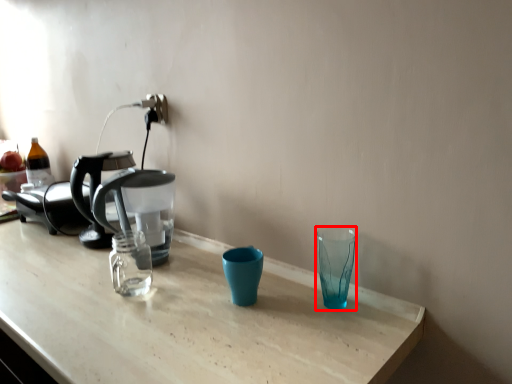
Question: From the image's perspective, what is the correct spatial relationship of shot glass (annotated by the red box) in relation to coffee maker?

Choices:
 (A) above
 (B) below

Answer: (B)